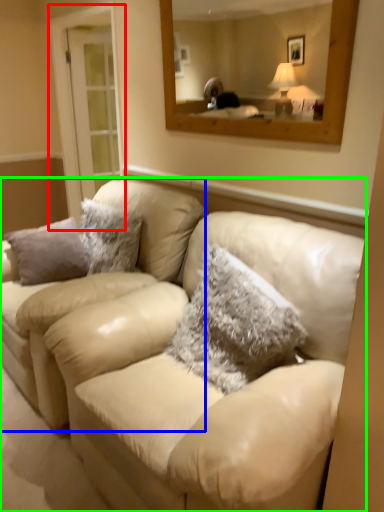
Question: Considering the real-world distances, which object is farthest from glass door (highlighted by a red box)? couch (highlighted by a blue box) or studio couch (highlighted by a green box)?

Choices:
 (A) couch
 (B) studio couch

Answer: (B)